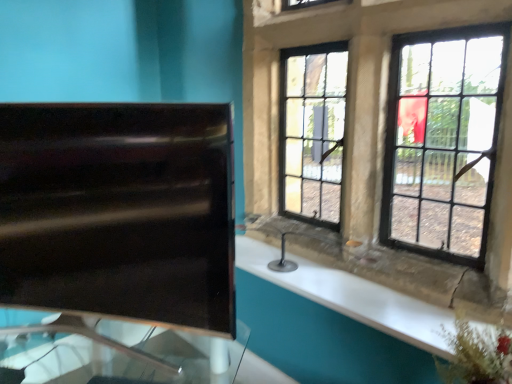
Question: From a real-world perspective, is transparent glass table at left physically below black glass window at upper right?

Choices:
 (A) no
 (B) yes

Answer: (B)

Question: Is transparent glass table at left thinner than black glass window at upper right?

Choices:
 (A) no
 (B) yes

Answer: (A)

Question: Does transparent glass table at left appear on the right side of black glass window at upper right?

Choices:
 (A) no
 (B) yes

Answer: (A)

Question: Is transparent glass table at left wider than black glass window at upper right?

Choices:
 (A) yes
 (B) no

Answer: (A)

Question: From the image's perspective, would you say transparent glass table at left is positioned over black glass window at upper right?

Choices:
 (A) yes
 (B) no

Answer: (B)

Question: Does transparent glass table at left have a greater height compared to black glass window at upper right?

Choices:
 (A) no
 (B) yes

Answer: (A)

Question: Considering the relative positions of black glossy sink at left and transparent glass table at left in the image provided, is black glossy sink at left to the right of transparent glass table at left from the viewer's perspective?

Choices:
 (A) yes
 (B) no

Answer: (A)

Question: Could you tell me if black glossy sink at left is facing transparent glass table at left?

Choices:
 (A) yes
 (B) no

Answer: (B)

Question: Does black glossy sink at left have a larger size compared to transparent glass table at left?

Choices:
 (A) yes
 (B) no

Answer: (B)

Question: Does black glossy sink at left have a lesser height compared to transparent glass table at left?

Choices:
 (A) yes
 (B) no

Answer: (B)

Question: Is black glossy sink at left taller than transparent glass table at left?

Choices:
 (A) yes
 (B) no

Answer: (A)

Question: Does black glossy sink at left come in front of transparent glass table at left?

Choices:
 (A) yes
 (B) no

Answer: (B)

Question: Is black glass window at upper right oriented towards black glossy sink at left?

Choices:
 (A) no
 (B) yes

Answer: (B)